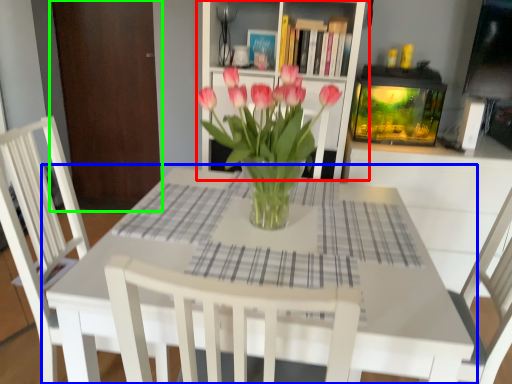
Question: Based on their relative distances, which object is nearer to shelf (highlighted by a red box)? Choose from table (highlighted by a blue box) and armoire (highlighted by a green box).

Choices:
 (A) table
 (B) armoire

Answer: (A)